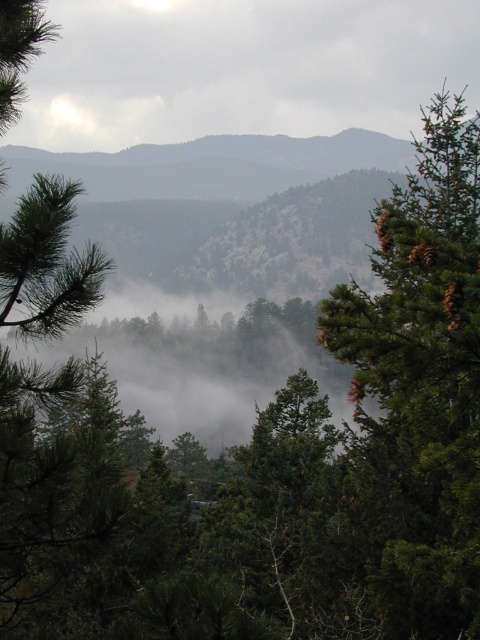
Question: Which of these objects is positioned farthest from the green needle-like at right?

Choices:
 (A) green needle-like tree at left
 (B) white fluffy cloud at upper center

Answer: (B)

Question: Can you confirm if green needle-like at right is positioned to the right of green needle-like tree at left?

Choices:
 (A) yes
 (B) no

Answer: (A)

Question: Is white fluffy cloud at upper center wider than green needle-like tree at left?

Choices:
 (A) yes
 (B) no

Answer: (A)

Question: Which point is farther to the camera?

Choices:
 (A) white fluffy cloud at upper center
 (B) green needle-like at right

Answer: (A)

Question: Does white fluffy cloud at upper center appear under green needle-like at right?

Choices:
 (A) no
 (B) yes

Answer: (A)

Question: Among these objects, which one is farthest from the camera?

Choices:
 (A) green needle-like at right
 (B) white fluffy cloud at upper center
 (C) green needle-like tree at left

Answer: (B)